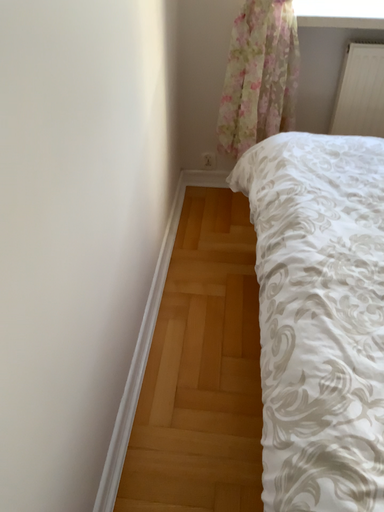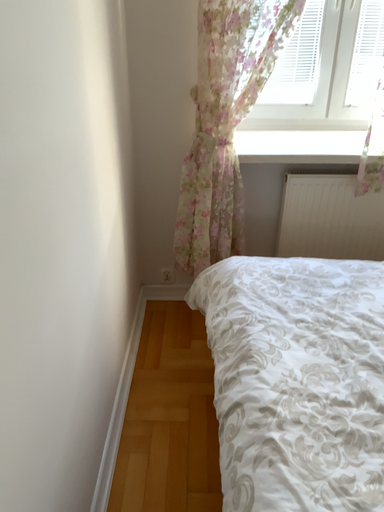
Question: How did the camera likely rotate when shooting the video?

Choices:
 (A) rotated downward
 (B) rotated upward

Answer: (B)